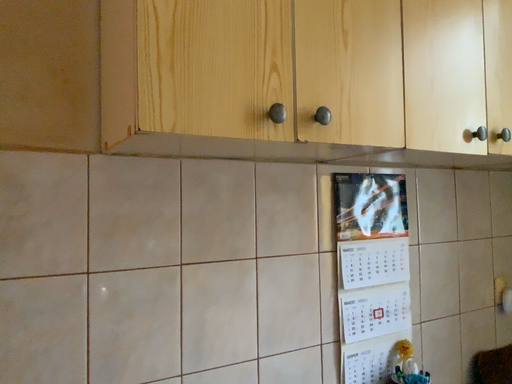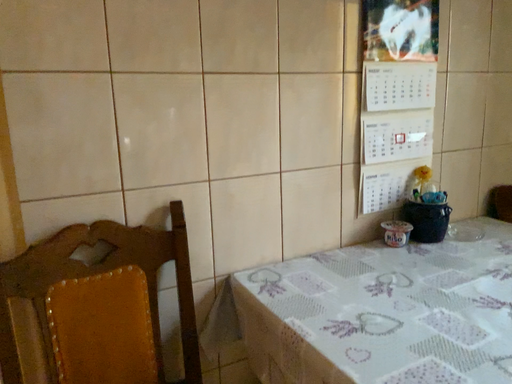
Question: Which way did the camera rotate in the video?

Choices:
 (A) rotated upward
 (B) rotated downward

Answer: (B)